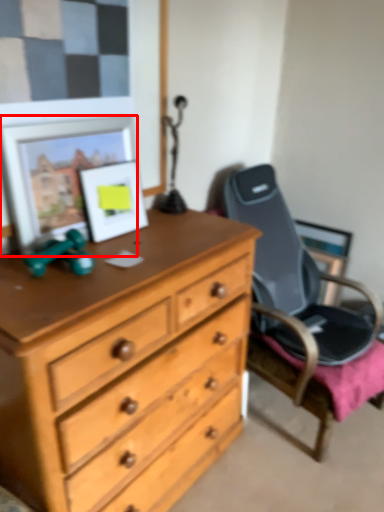
Question: In this image, where is picture frame (annotated by the red box) located relative to picture frame?

Choices:
 (A) left
 (B) right

Answer: (A)